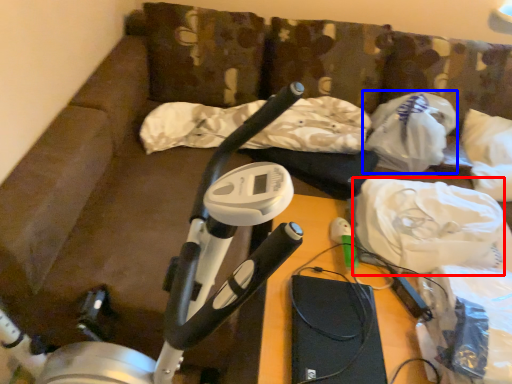
Question: Which of the following is the farthest to the observer, material (highlighted by a red box) or plastic bag (highlighted by a blue box)?

Choices:
 (A) material
 (B) plastic bag

Answer: (B)